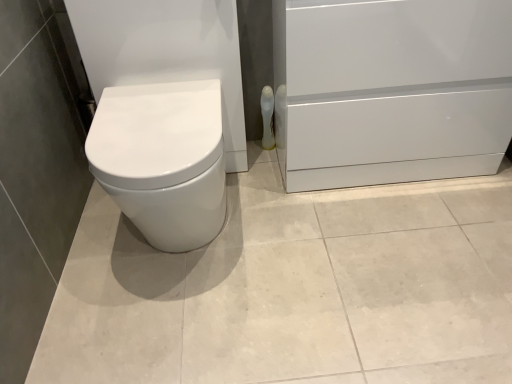
What do you see at coordinates (267, 117) in the screenshot? I see `white glossy toilet paper at center-right` at bounding box center [267, 117].

You are a GUI agent. You are given a task and a screenshot of the screen. Output one action in this format:
    pyautogui.click(x=<x>, y=<y>)
    Task: Click on the white glossy toilet paper at center-right
    
    Given the screenshot: What is the action you would take?
    pyautogui.click(x=267, y=117)

What do you see at coordinates (380, 84) in the screenshot?
I see `white glossy file cabinet at lower right` at bounding box center [380, 84].

The width and height of the screenshot is (512, 384). In order to click on white glossy file cabinet at lower right in this screenshot , I will do `click(380, 84)`.

Locate an element on the screen. The height and width of the screenshot is (384, 512). white glossy toilet paper at center-right is located at coordinates (267, 117).

Between white glossy toilet paper at center-right and white glossy file cabinet at lower right, which one appears on the right side from the viewer's perspective?

Positioned to the right is white glossy file cabinet at lower right.

Is white glossy toilet paper at center-right closer to camera compared to white glossy file cabinet at lower right?

No, white glossy toilet paper at center-right is further to the viewer.

Is point (266, 106) more distant than point (428, 34)?

Yes, it is behind point (428, 34).

From the image's perspective, is white glossy toilet paper at center-right under white glossy file cabinet at lower right?

Correct, white glossy toilet paper at center-right appears lower than white glossy file cabinet at lower right in the image.

From a real-world perspective, between white glossy toilet paper at center-right and white glossy file cabinet at lower right, who is vertically lower?

In real-world perspective, white glossy toilet paper at center-right is lower.

Is white glossy toilet paper at center-right wider than white glossy file cabinet at lower right?

No.

In terms of height, does white glossy toilet paper at center-right look taller or shorter compared to white glossy file cabinet at lower right?

Clearly, white glossy toilet paper at center-right is shorter compared to white glossy file cabinet at lower right.

In terms of size, does white glossy toilet paper at center-right appear bigger or smaller than white glossy file cabinet at lower right?

Clearly, white glossy toilet paper at center-right is smaller in size than white glossy file cabinet at lower right.

Based on the photo, is white glossy toilet paper at center-right located outside white glossy file cabinet at lower right?

That's correct, white glossy toilet paper at center-right is outside of white glossy file cabinet at lower right.

Are white glossy toilet paper at center-right and white glossy file cabinet at lower right located far from each other?

→ Actually, white glossy toilet paper at center-right and white glossy file cabinet at lower right are a little close together.

Is white glossy toilet paper at center-right looking in the opposite direction of white glossy file cabinet at lower right?

white glossy toilet paper at center-right is not turned away from white glossy file cabinet at lower right.

What's the angular difference between white glossy toilet paper at center-right and white glossy file cabinet at lower right's facing directions?

They differ by 0.805 degrees in their facing directions.

In order to click on file cabinet in front of the white glossy toilet paper at center-right in this screenshot , I will do `click(380, 84)`.

Based on their positions, is white glossy file cabinet at lower right located to the left or right of white glossy toilet paper at center-right?

white glossy file cabinet at lower right is positioned on white glossy toilet paper at center-right's right side.

Which object is closer to the camera taking this photo, white glossy file cabinet at lower right or white glossy toilet paper at center-right?

white glossy file cabinet at lower right is more forward.

Which is farther from the camera, (245, 42) or (265, 101)?

Point (265, 101)

Consider the image. From the image's perspective, is white glossy file cabinet at lower right located above or below white glossy toilet paper at center-right?

white glossy file cabinet at lower right is above white glossy toilet paper at center-right.

From a real-world perspective, relative to white glossy toilet paper at center-right, is white glossy file cabinet at lower right vertically above or below?

Clearly, from a real-world perspective, white glossy file cabinet at lower right is above white glossy toilet paper at center-right.

Considering the relative sizes of white glossy file cabinet at lower right and white glossy toilet paper at center-right in the image provided, is white glossy file cabinet at lower right wider than white glossy toilet paper at center-right?

Correct, the width of white glossy file cabinet at lower right exceeds that of white glossy toilet paper at center-right.

Who is taller, white glossy file cabinet at lower right or white glossy toilet paper at center-right?

white glossy file cabinet at lower right is taller.

Based on their sizes in the image, would you say white glossy file cabinet at lower right is bigger or smaller than white glossy toilet paper at center-right?

Clearly, white glossy file cabinet at lower right is larger in size than white glossy toilet paper at center-right.

Does white glossy file cabinet at lower right contain white glossy toilet paper at center-right?

No, white glossy file cabinet at lower right does not contain white glossy toilet paper at center-right.

Are white glossy file cabinet at lower right and white glossy toilet paper at center-right located far from each other?

Actually, white glossy file cabinet at lower right and white glossy toilet paper at center-right are a little close together.

Could you tell me if white glossy file cabinet at lower right is facing white glossy toilet paper at center-right?

No, white glossy file cabinet at lower right is not aimed at white glossy toilet paper at center-right.

Locate an element on the screen. This screenshot has width=512, height=384. toilet paper on the left of white glossy file cabinet at lower right is located at coordinates (267, 117).

The width and height of the screenshot is (512, 384). Find the location of `toilet paper beneath the white glossy file cabinet at lower right (from a real-world perspective)`. toilet paper beneath the white glossy file cabinet at lower right (from a real-world perspective) is located at coordinates (267, 117).

This screenshot has height=384, width=512. In order to click on file cabinet that is in front of the white glossy toilet paper at center-right in this screenshot , I will do pos(380,84).